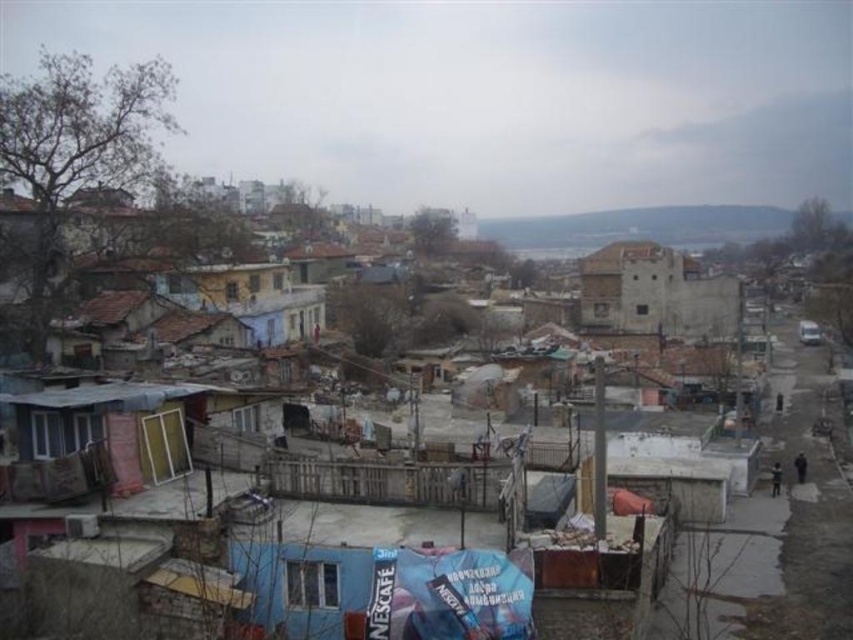
Question: Is wooden planks hut at lower left positioned before weathered stone building at center?

Choices:
 (A) no
 (B) yes

Answer: (B)

Question: Does wooden planks hut at lower left have a larger size compared to weathered stone building at center?

Choices:
 (A) no
 (B) yes

Answer: (A)

Question: Is wooden planks hut at lower left to the right of weathered stone building at center from the viewer's perspective?

Choices:
 (A) no
 (B) yes

Answer: (A)

Question: Among these objects, which one is farthest from the camera?

Choices:
 (A) weathered stone building at center
 (B) wooden planks hut at lower left

Answer: (A)